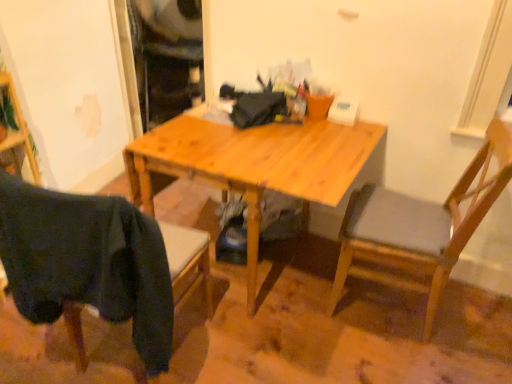
Question: Is dark fabric chair at lower left, which is the 1th chair in left-to-right order, bigger or smaller than wooden chair at right, the first chair in the right-to-left sequence?

Choices:
 (A) big
 (B) small

Answer: (B)

Question: Is dark fabric chair at lower left, which is the 1th chair in left-to-right order, to the left or to the right of wooden chair at right, the first chair in the right-to-left sequence, in the image?

Choices:
 (A) left
 (B) right

Answer: (A)

Question: Which object is the closest to the light wood desk at center?

Choices:
 (A) wooden chair at right, the first chair in the right-to-left sequence
 (B) dark fabric chair at lower left, which is the 1th chair in left-to-right order

Answer: (A)

Question: Which is farther from the light wood desk at center?

Choices:
 (A) dark fabric chair at lower left, which is the 1th chair in left-to-right order
 (B) wooden chair at right, the first chair in the right-to-left sequence

Answer: (A)